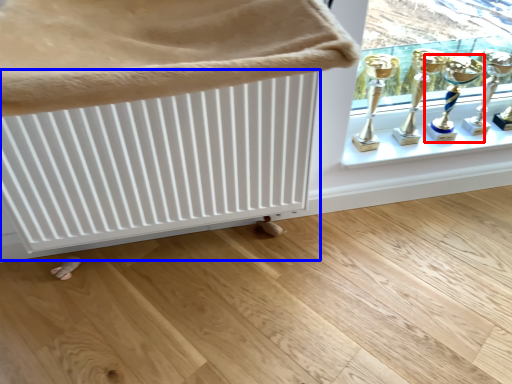
Question: Which point is closer to the camera, candle holder (highlighted by a red box) or radiator (highlighted by a blue box)?

Choices:
 (A) candle holder
 (B) radiator

Answer: (B)